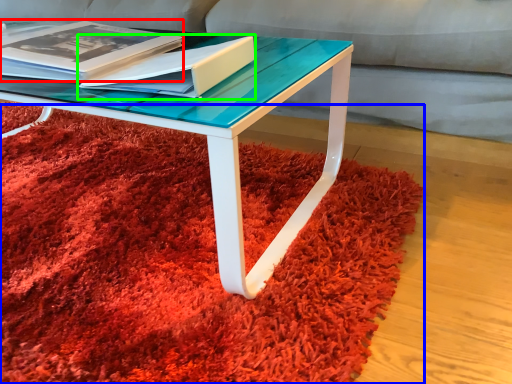
Question: Considering the real-world distances, which object is closest to magazine (highlighted by a red box)? mat (highlighted by a blue box) or paperback book (highlighted by a green box).

Choices:
 (A) mat
 (B) paperback book

Answer: (B)